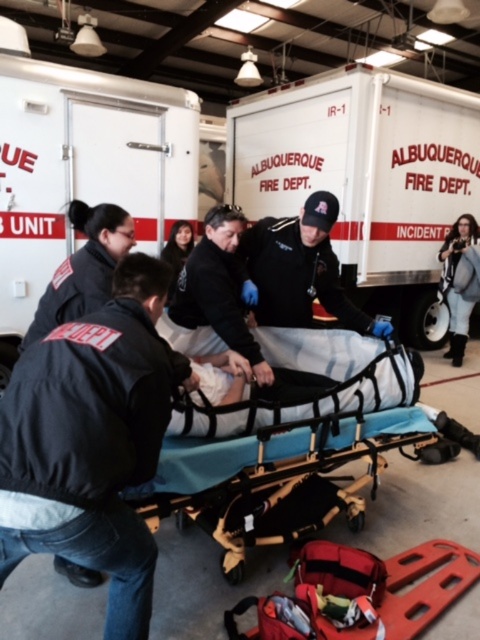
What are the coordinates of the white matte ambulance at center?

The white matte ambulance at center is located at coordinates point (x=365, y=179).